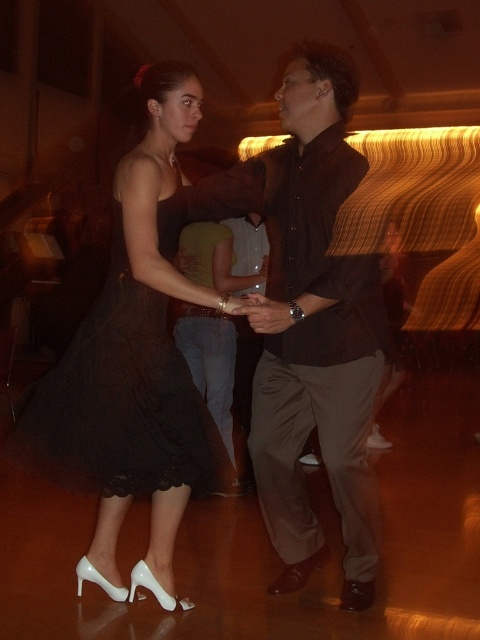
Question: Which of these objects is positioned farthest from the black lace dress at left?

Choices:
 (A) black lace dress at center
 (B) brown matte shirt at center

Answer: (B)

Question: Which point is farther to the camera?

Choices:
 (A) black lace dress at left
 (B) brown matte shirt at center
 (C) black lace dress at center

Answer: (A)

Question: Does black lace dress at center appear on the left side of brown matte shirt at center?

Choices:
 (A) no
 (B) yes

Answer: (B)

Question: Which object appears closest to the camera in this image?

Choices:
 (A) black lace dress at center
 (B) black lace dress at left
 (C) brown matte shirt at center

Answer: (A)

Question: In this image, where is brown matte shirt at center located relative to black lace dress at left?

Choices:
 (A) right
 (B) left

Answer: (A)

Question: Observing the image, what is the correct spatial positioning of black lace dress at center in reference to black lace dress at left?

Choices:
 (A) left
 (B) right

Answer: (B)